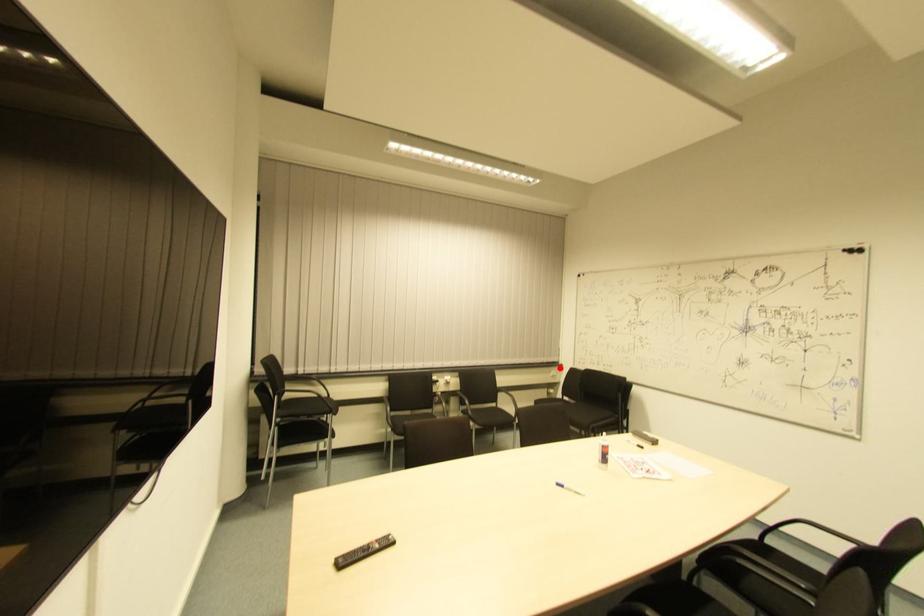
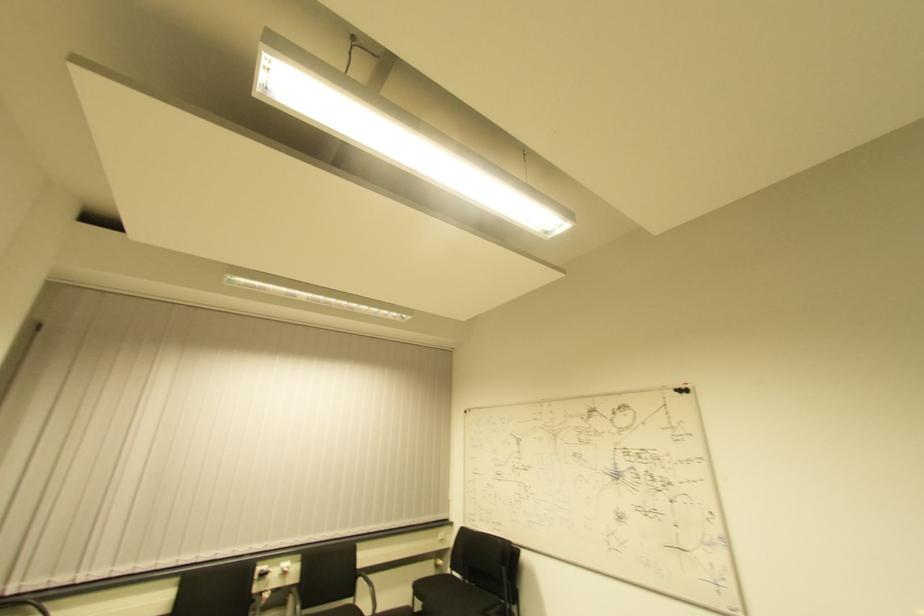
Find the pixel in the second image that matches the highlighted location in the first image.

(450, 527)